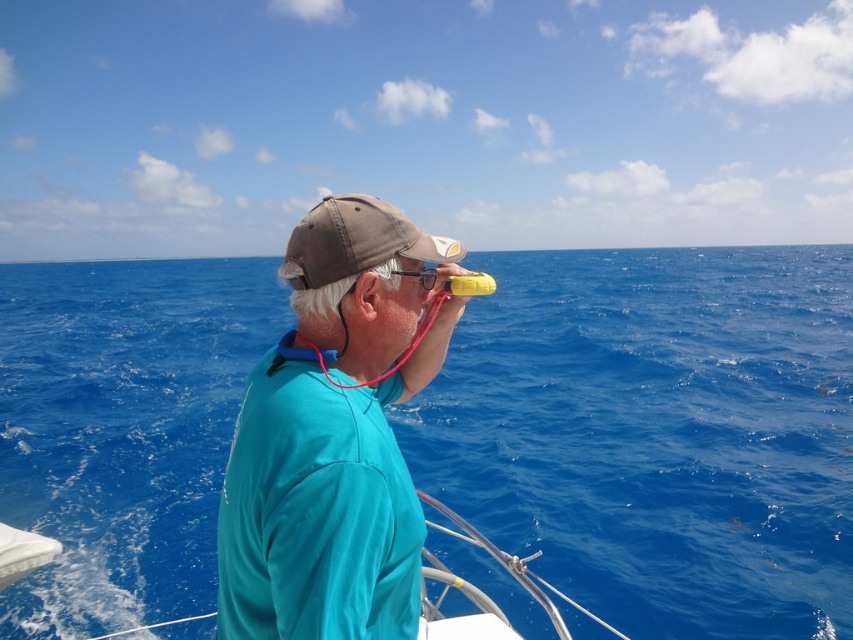
You are a photographer trying to capture a clear image of the rubberized translucent goggles at center. However, the teal fabric shirt at center is blocking your view. Can you adjust your position to see the goggles without the shirt in the way?

The teal fabric shirt at center is in front of the rubberized translucent goggles at center, so moving your camera position to the side or angle downward might allow you to see the goggles without the shirt blocking the view.

You are a photographer trying to capture a closeup shot of the brown cotton baseball cap at center and the rubberized translucent goggles at center. Which object should you zoom in more on to ensure both are in focus?

Since the brown cotton baseball cap at center is wider than the rubberized translucent goggles at center, you should zoom in more on the cap to ensure both objects are in focus.

You are a photographer trying to capture the person in the scene. You notice the teal fabric shirt at center and the rubberized translucent goggles at center. Which object should you focus on first if you want to ensure both are in the frame?

The teal fabric shirt at center is positioned on the left side of the rubberized translucent goggles at center, so focusing on the goggles first will ensure both objects remain in the frame as the shirt is to the left of the goggles.